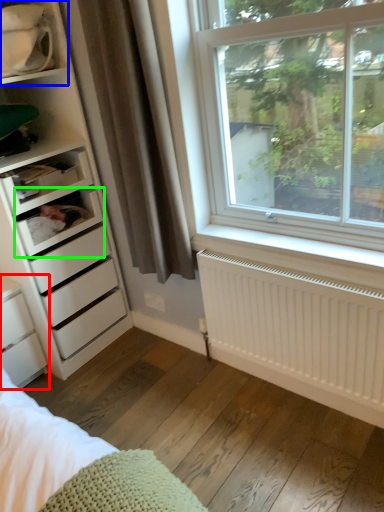
Question: Which object is the farthest from chest of drawers (highlighted by a red box)? Choose among these: shelf (highlighted by a blue box) or shelf (highlighted by a green box).

Choices:
 (A) shelf
 (B) shelf

Answer: (A)